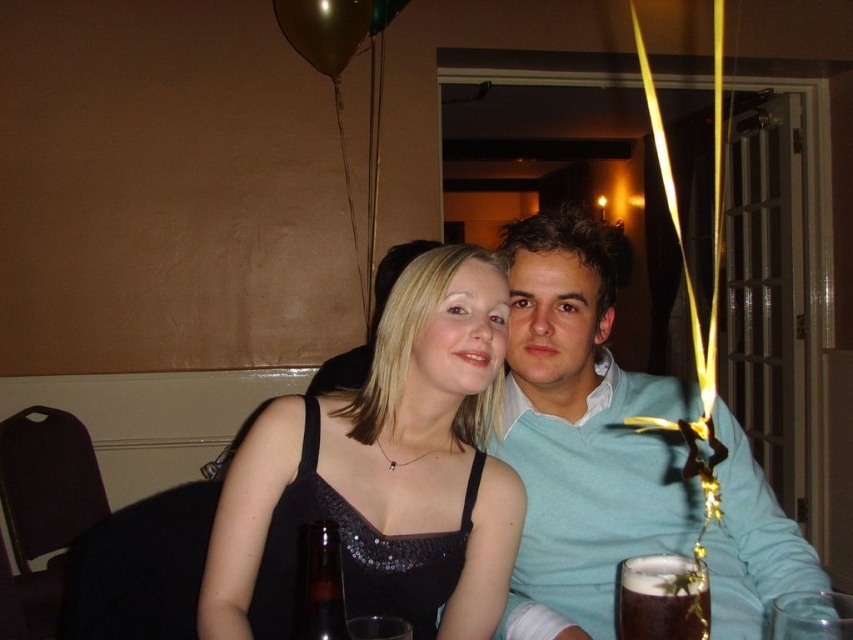
You are a photographer setting up for a portrait in this scene. You need to place a small tripod between the gold metallic balloon at upper center and the brown glass bottle at lower center. Based on their positions, which object should the tripod be closer to?

The gold metallic balloon at upper center is positioned on the left side of brown glass bottle at lower center, so the tripod should be placed closer to the gold metallic balloon at upper center to maintain symmetry between the two objects.